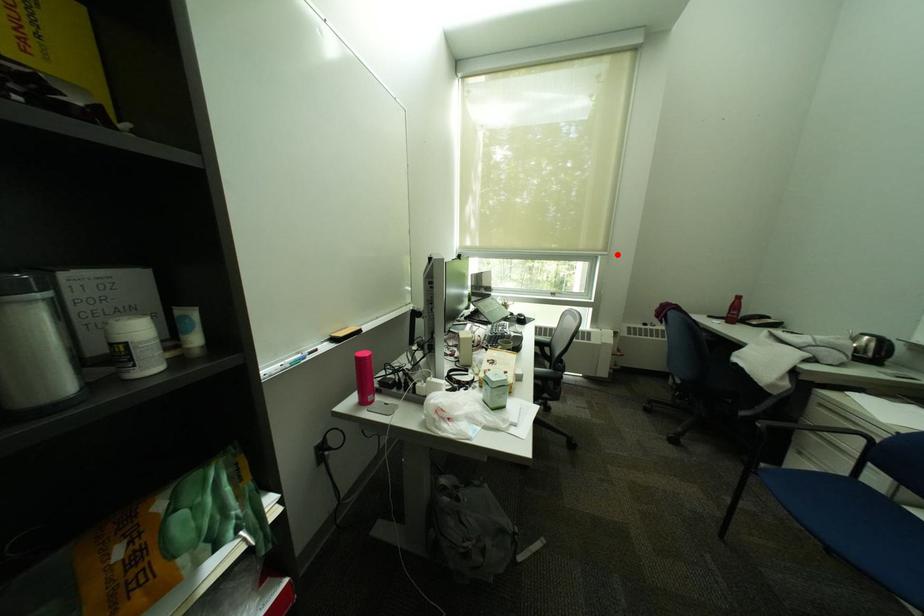
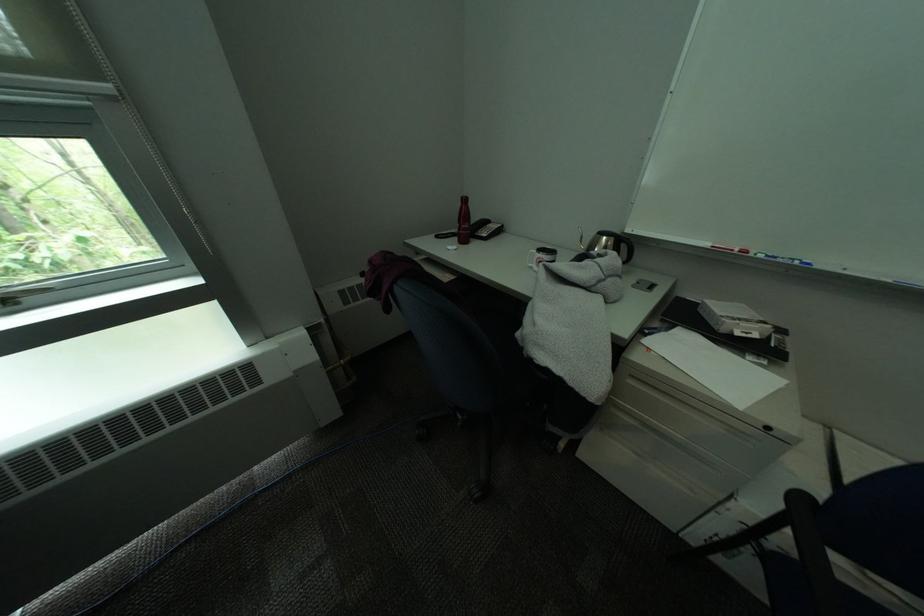
Find the pixel in the second image that matches the highlighted location in the first image.

(119, 87)